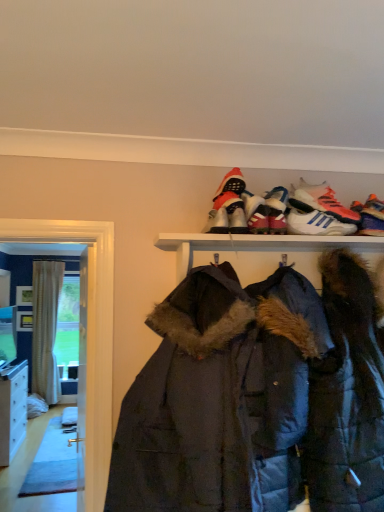
What do you see at coordinates (321, 202) in the screenshot? This screenshot has height=512, width=384. I see `white leather sneakers at upper center, which is the 5th footwear in left-to-right order` at bounding box center [321, 202].

Based on the photo, how much space does white leather sneaker at upper center, the sixth footwear in the right-to-left sequence, occupy vertically?

4.25 inches.

You are a GUI agent. You are given a task and a screenshot of the screen. Output one action in this format:
    pyautogui.click(x=<x>, y=<y>)
    Task: Click on the multicolored knitted socks at upper right, which is the 1th footwear in right-to-left order
    The height and width of the screenshot is (512, 384).
    Given the screenshot: What is the action you would take?
    pyautogui.click(x=372, y=217)

Image resolution: width=384 pixels, height=512 pixels. I want to click on white leather sneakers at upper center, which is the 5th footwear in left-to-right order, so click(x=321, y=202).

Considering the relative positions of white synthetic sneakers at upper center, which ranks as the third footwear in right-to-left order, and shiny black sneaker at upper center in the image provided, is white synthetic sneakers at upper center, which ranks as the third footwear in right-to-left order, to the left of shiny black sneaker at upper center from the viewer's perspective?

In fact, white synthetic sneakers at upper center, which ranks as the third footwear in right-to-left order, is to the right of shiny black sneaker at upper center.

Starting from the shiny black sneaker at upper center, which footwear is the 1st one to the right? Please provide its 2D coordinates.

[(315, 221)]

Considering the relative positions of white synthetic sneakers at upper center, placed as the 4th footwear when sorted from left to right, and shiny black sneaker at upper center in the image provided, is white synthetic sneakers at upper center, placed as the 4th footwear when sorted from left to right, behind shiny black sneaker at upper center?

Yes, the depth of white synthetic sneakers at upper center, placed as the 4th footwear when sorted from left to right, is greater than that of shiny black sneaker at upper center.

From the image's perspective, is white synthetic sneakers at upper center, which ranks as the third footwear in right-to-left order, above shiny black sneaker at upper center?

Yes.

Does dark blue quilted jacket at center have a greater width compared to red suede boot at upper center, arranged as the fifth footwear when viewed from the right?

Correct, the width of dark blue quilted jacket at center exceeds that of red suede boot at upper center, arranged as the fifth footwear when viewed from the right.

Is red suede boot at upper center, arranged as the fifth footwear when viewed from the right, surrounded by dark blue quilted jacket at center?

No, red suede boot at upper center, arranged as the fifth footwear when viewed from the right, is not inside dark blue quilted jacket at center.

How many degrees apart are the facing directions of dark blue quilted jacket at center and red suede boot at upper center, the second footwear in the left-to-right sequence?

dark blue quilted jacket at center and red suede boot at upper center, the second footwear in the left-to-right sequence, are facing 2.86 degrees away from each other.

Between dark blue quilted jacket at center and red suede boot at upper center, the second footwear in the left-to-right sequence, which one appears on the left side from the viewer's perspective?

From the viewer's perspective, red suede boot at upper center, the second footwear in the left-to-right sequence, appears more on the left side.

Which is more to the right, shiny black sneaker at upper center, the fourth footwear viewed from the right, or red suede boot at upper center, arranged as the fifth footwear when viewed from the right?

From the viewer's perspective, shiny black sneaker at upper center, the fourth footwear viewed from the right, appears more on the right side.

Considering the sizes of objects shiny black sneaker at upper center, the fourth footwear viewed from the right, and red suede boot at upper center, arranged as the fifth footwear when viewed from the right, in the image provided, who is wider, shiny black sneaker at upper center, the fourth footwear viewed from the right, or red suede boot at upper center, arranged as the fifth footwear when viewed from the right,?

red suede boot at upper center, arranged as the fifth footwear when viewed from the right, is wider.

Is shiny black sneaker at upper center, the third footwear positioned from the left, spatially inside red suede boot at upper center, arranged as the fifth footwear when viewed from the right, or outside of it?

shiny black sneaker at upper center, the third footwear positioned from the left, cannot be found inside red suede boot at upper center, arranged as the fifth footwear when viewed from the right.

From the image's perspective, which is above, shiny black sneaker at upper center, the third footwear positioned from the left, or red suede boot at upper center, arranged as the fifth footwear when viewed from the right?

red suede boot at upper center, arranged as the fifth footwear when viewed from the right.

Is dark blue quilted jacket at center wider than multicolored knitted socks at upper right, which is the 1th footwear in right-to-left order?

Indeed, dark blue quilted jacket at center has a greater width compared to multicolored knitted socks at upper right, which is the 1th footwear in right-to-left order.

Is dark blue quilted jacket at center located outside multicolored knitted socks at upper right, which is the 1th footwear in right-to-left order?

Indeed, dark blue quilted jacket at center is completely outside multicolored knitted socks at upper right, which is the 1th footwear in right-to-left order.

Considering the points (293, 339) and (360, 227), which point is in front, point (293, 339) or point (360, 227)?

Point (293, 339)

Is white leather sneaker at upper center, the sixth footwear in the right-to-left sequence, completely or partially inside white leather sneakers at upper center, which is the 5th footwear in left-to-right order?

No, white leather sneaker at upper center, the sixth footwear in the right-to-left sequence, is not a part of white leather sneakers at upper center, which is the 5th footwear in left-to-right order.

Considering the sizes of objects white leather sneakers at upper center, which is the second footwear in right-to-left order, and white leather sneaker at upper center, the first footwear in the left-to-right sequence, in the image provided, who is bigger, white leather sneakers at upper center, which is the second footwear in right-to-left order, or white leather sneaker at upper center, the first footwear in the left-to-right sequence,?

white leather sneakers at upper center, which is the second footwear in right-to-left order, is bigger.

Is white leather sneakers at upper center, which is the 5th footwear in left-to-right order, in front of white leather sneaker at upper center, the sixth footwear in the right-to-left sequence?

No, it is not.

Is white leather sneaker at upper center, the first footwear in the left-to-right sequence, turned away from white synthetic sneakers at upper center, which ranks as the third footwear in right-to-left order?

No, white leather sneaker at upper center, the first footwear in the left-to-right sequence, is not facing away from white synthetic sneakers at upper center, which ranks as the third footwear in right-to-left order.

Does point (209, 232) lie behind point (334, 227)?

No, (209, 232) is in front of (334, 227).

From a real-world perspective, is white leather sneaker at upper center, the first footwear in the left-to-right sequence, under white synthetic sneakers at upper center, placed as the 4th footwear when sorted from left to right?

Yes, from a real-world perspective, white leather sneaker at upper center, the first footwear in the left-to-right sequence, is under white synthetic sneakers at upper center, placed as the 4th footwear when sorted from left to right.

Is white leather sneaker at upper center, the sixth footwear in the right-to-left sequence, shorter than white synthetic sneakers at upper center, placed as the 4th footwear when sorted from left to right?

Indeed, white leather sneaker at upper center, the sixth footwear in the right-to-left sequence, has a lesser height compared to white synthetic sneakers at upper center, placed as the 4th footwear when sorted from left to right.

Based on their sizes in the image, would you say white glossy cabinet at lower left is bigger or smaller than white synthetic sneakers at upper center, placed as the 4th footwear when sorted from left to right?

In the image, white glossy cabinet at lower left appears to be larger than white synthetic sneakers at upper center, placed as the 4th footwear when sorted from left to right.

Is white glossy cabinet at lower left directly adjacent to white synthetic sneakers at upper center, placed as the 4th footwear when sorted from left to right?

No.

Could you tell me if white glossy cabinet at lower left is turned towards white synthetic sneakers at upper center, placed as the 4th footwear when sorted from left to right?

No, white glossy cabinet at lower left is not facing towards white synthetic sneakers at upper center, placed as the 4th footwear when sorted from left to right.

From the image's perspective, which one is positioned higher, white glossy cabinet at lower left or white synthetic sneakers at upper center, placed as the 4th footwear when sorted from left to right?

white synthetic sneakers at upper center, placed as the 4th footwear when sorted from left to right, is shown above in the image.

Starting from the shiny black sneaker at upper center, which footwear is the 2nd one behind? Please provide its 2D coordinates.

[(315, 221)]

Locate an element on the screen. the 6th footwear positioned above the dark blue quilted jacket at center (from a real-world perspective) is located at coordinates (231, 183).

Estimate the real-world distances between objects in this image. Which object is closer to shiny black sneaker at upper center, the third footwear positioned from the left, dark blue quilted jacket at center or red suede boot at upper center, arranged as the fifth footwear when viewed from the right?

red suede boot at upper center, arranged as the fifth footwear when viewed from the right, lies closer to shiny black sneaker at upper center, the third footwear positioned from the left, than the other object.

Based on their spatial positions, is dark blue quilted jacket at center or white glossy cabinet at lower left further from white leather sneakers at upper center, which is the second footwear in right-to-left order?

white glossy cabinet at lower left.

Which object lies further to the anchor point shiny black sneaker at upper center, multicolored knitted socks at upper right, which appears as the 6th footwear when viewed from the left, or beige striped curtain at left?

beige striped curtain at left lies further to shiny black sneaker at upper center than the other object.

Estimate the real-world distances between objects in this image. Which object is further from shiny black sneaker at upper center, the fourth footwear viewed from the right, white leather sneakers at upper center, which is the 5th footwear in left-to-right order, or white synthetic sneakers at upper center, which ranks as the third footwear in right-to-left order?

white leather sneakers at upper center, which is the 5th footwear in left-to-right order, lies further to shiny black sneaker at upper center, the fourth footwear viewed from the right, than the other object.

Looking at the image, which one is located further to multicolored knitted socks at upper right, which is the 1th footwear in right-to-left order, shiny black sneaker at upper center or white glossy cabinet at lower left?

Among the two, white glossy cabinet at lower left is located further to multicolored knitted socks at upper right, which is the 1th footwear in right-to-left order.

Which object lies further to the anchor point red suede boot at upper center, arranged as the fifth footwear when viewed from the right, white glossy cabinet at lower left or beige striped curtain at left?

Based on the image, beige striped curtain at left appears to be further to red suede boot at upper center, arranged as the fifth footwear when viewed from the right.

Considering their positions, is shiny black sneaker at upper center, the third footwear positioned from the left, positioned closer to white synthetic sneakers at upper center, placed as the 4th footwear when sorted from left to right, than white glossy cabinet at lower left?

shiny black sneaker at upper center, the third footwear positioned from the left, lies closer to white synthetic sneakers at upper center, placed as the 4th footwear when sorted from left to right, than the other object.

When comparing their distances from beige striped curtain at left, does white glossy cabinet at lower left or dark blue quilted jacket at center seem closer?

white glossy cabinet at lower left is closer to beige striped curtain at left.

Locate an element on the screen. Image resolution: width=384 pixels, height=512 pixels. shoe between white leather sneaker at upper center, the sixth footwear in the right-to-left sequence, and white leather sneakers at upper center, which is the second footwear in right-to-left order, in the horizontal direction is located at coordinates (277, 218).

The width and height of the screenshot is (384, 512). I want to click on footwear between white leather sneaker at upper center, the sixth footwear in the right-to-left sequence, and dark blue quilted jacket at center, in the vertical direction, so click(x=237, y=218).

Where is `shoe between white glossy cabinet at lower left and multicolored knitted socks at upper right, which appears as the 6th footwear when viewed from the left, in the horizontal direction`? The width and height of the screenshot is (384, 512). shoe between white glossy cabinet at lower left and multicolored knitted socks at upper right, which appears as the 6th footwear when viewed from the left, in the horizontal direction is located at coordinates (277, 218).

Where is `shoe between dark blue quilted jacket at center and beige striped curtain at left in the front-back direction`? This screenshot has height=512, width=384. shoe between dark blue quilted jacket at center and beige striped curtain at left in the front-back direction is located at coordinates (277, 218).